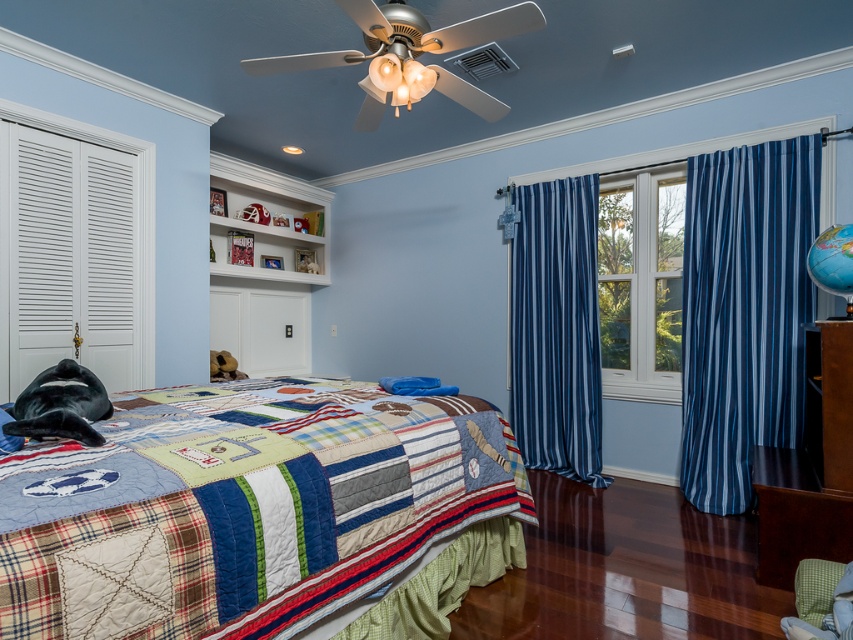
Based on the photo, does white louvered closet door at left have a larger size compared to dark brown wood dresser at lower right?

No.

Find the location of a particular element. This screenshot has width=853, height=640. white louvered closet door at left is located at coordinates (74, 252).

I want to click on white louvered closet door at left, so click(x=74, y=252).

Does white louvered closet door at left appear on the left side of white wood window at center?

Correct, you'll find white louvered closet door at left to the left of white wood window at center.

Can you confirm if white louvered closet door at left is wider than white wood window at center?

Incorrect, white louvered closet door at left's width does not surpass white wood window at center's.

Does point (68, 125) come closer to viewer compared to point (654, 301)?

Yes, point (68, 125) is in front of point (654, 301).

The image size is (853, 640). Find the location of `white louvered closet door at left`. white louvered closet door at left is located at coordinates (74, 252).

Does blue striped curtain at right appear on the right side of white louvered closet door at left?

Yes, blue striped curtain at right is to the right of white louvered closet door at left.

Is point (685, 396) positioned before point (45, 179)?

That is False.

This screenshot has width=853, height=640. What are the coordinates of `blue striped curtain at right` in the screenshot? It's located at (744, 310).